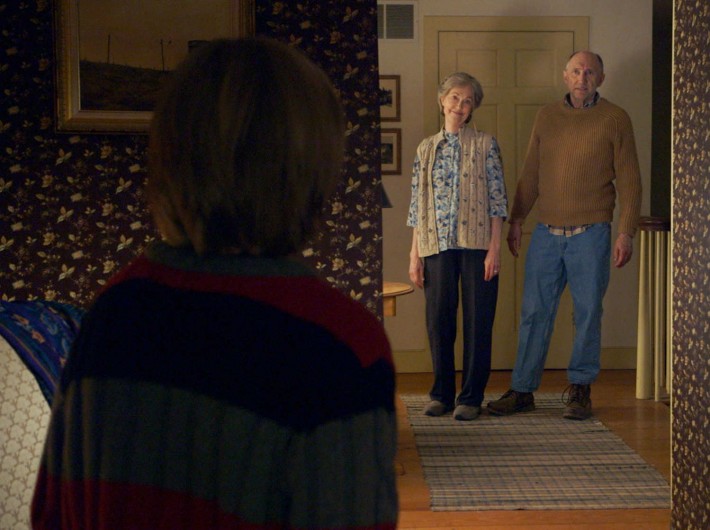
Find the location of a particular element. The width and height of the screenshot is (710, 530). painting is located at coordinates (98, 45).